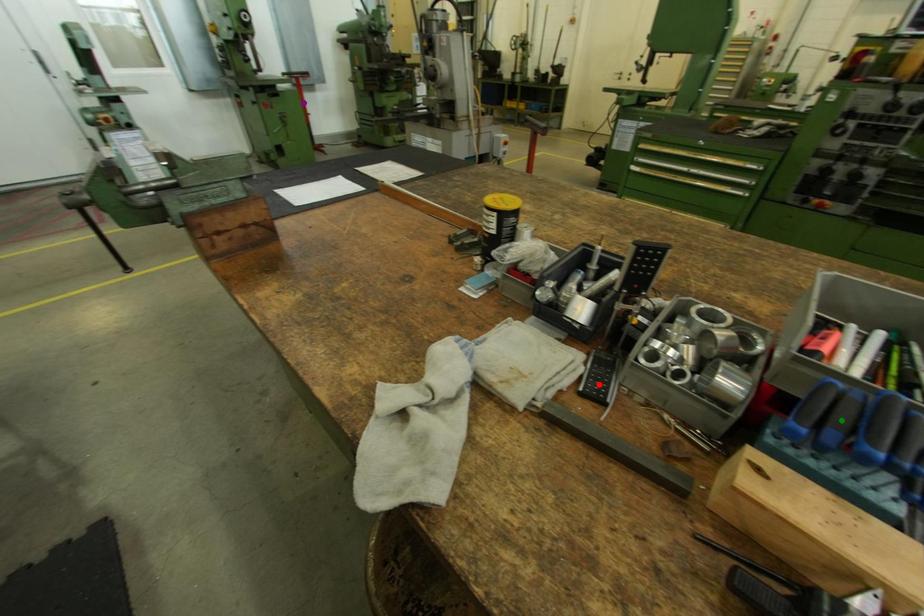
Order these from nearest to farthest:
red point
purple point
green point

green point, red point, purple point